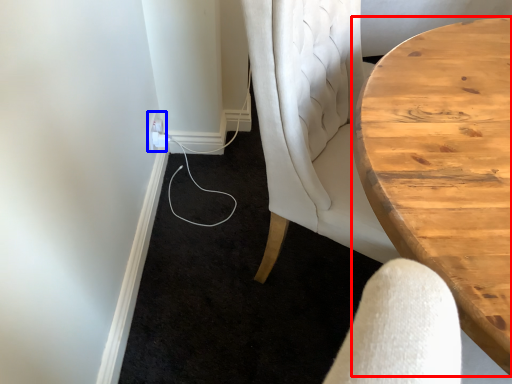
Question: Among these objects, which one is farthest to the camera, table (highlighted by a red box) or electric outlet (highlighted by a blue box)?

Choices:
 (A) table
 (B) electric outlet

Answer: (B)